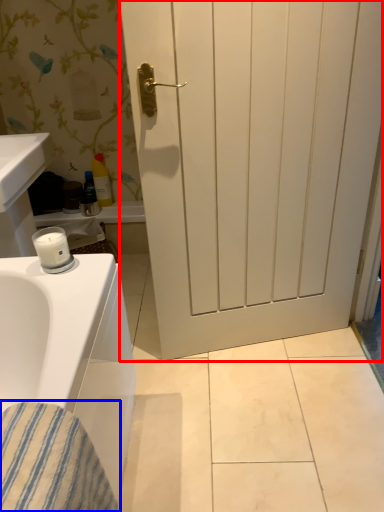
Question: Which object is closer to the camera taking this photo, door (highlighted by a red box) or material (highlighted by a blue box)?

Choices:
 (A) door
 (B) material

Answer: (B)